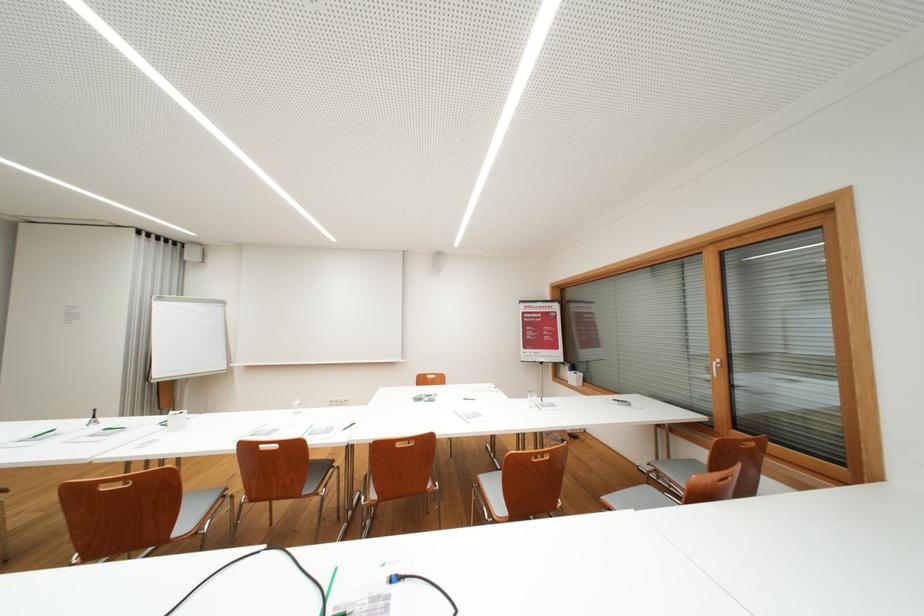
What do you see at coordinates (714, 367) in the screenshot?
I see `the silver window handle` at bounding box center [714, 367].